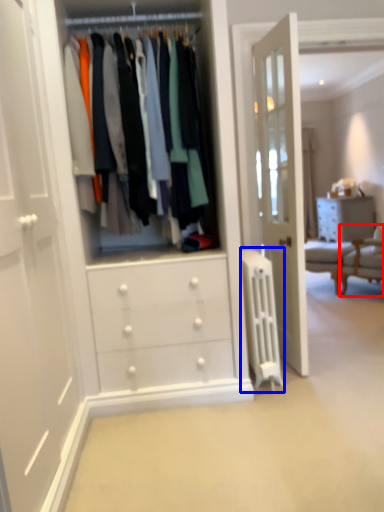
Question: Which of the following is the closest to the observer, furniture (highlighted by a red box) or wide (highlighted by a blue box)?

Choices:
 (A) furniture
 (B) wide

Answer: (B)